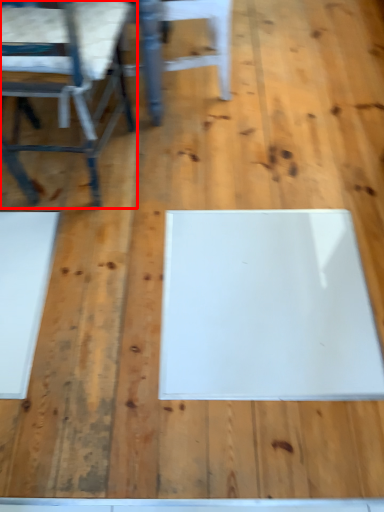
Question: In this image, where is chair (annotated by the red box) located relative to chair?

Choices:
 (A) right
 (B) left

Answer: (B)